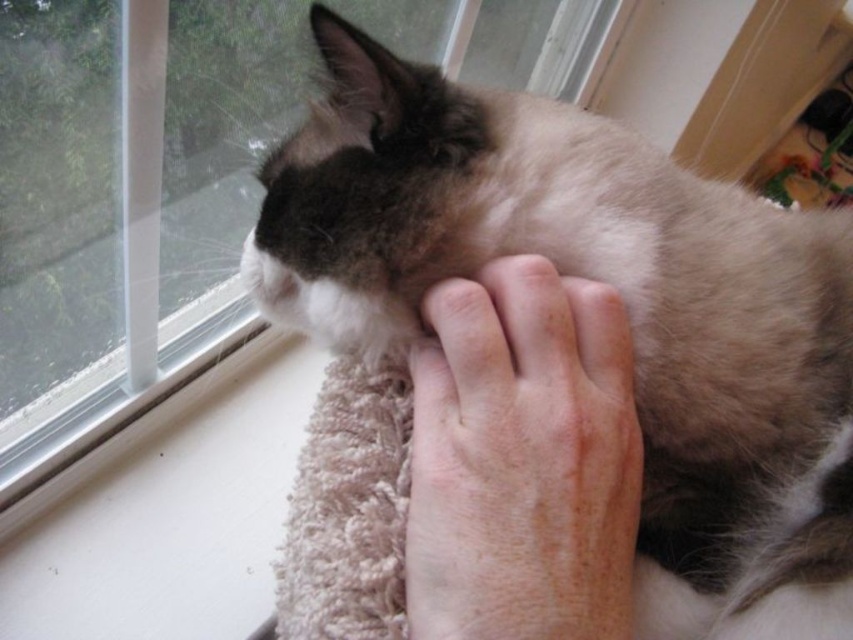
Question: Is dry skin at center behind clear glass window at upper left?

Choices:
 (A) yes
 (B) no

Answer: (B)

Question: Is dry skin at center smaller than clear glass window at upper left?

Choices:
 (A) yes
 (B) no

Answer: (A)

Question: Among these points, which one is nearest to the camera?

Choices:
 (A) (155, 269)
 (B) (630, 449)

Answer: (B)

Question: Observing the image, what is the correct spatial positioning of dry skin at center in reference to clear glass window at upper left?

Choices:
 (A) right
 (B) left

Answer: (A)